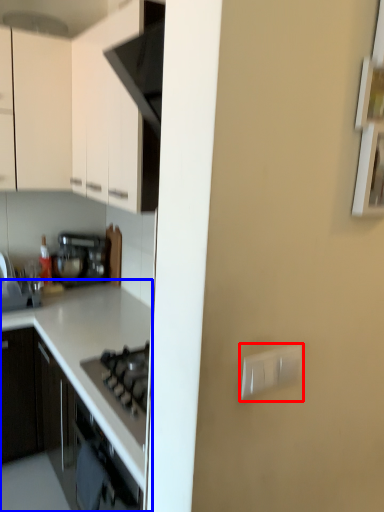
Question: Among these objects, which one is farthest to the camera, electric outlet (highlighted by a red box) or countertop (highlighted by a blue box)?

Choices:
 (A) electric outlet
 (B) countertop

Answer: (B)